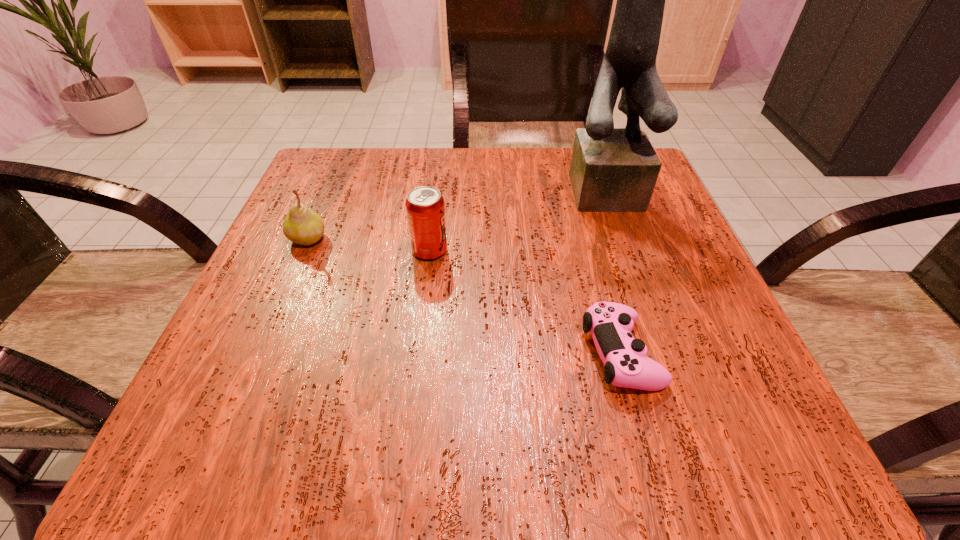
Locate an element on the screen. This screenshot has width=960, height=540. vacant space at the near right corner of the desktop is located at coordinates (764, 404).

The width and height of the screenshot is (960, 540). Find the location of `vacant area between the farthest object and the shortest object`. vacant area between the farthest object and the shortest object is located at coordinates (617, 269).

This screenshot has width=960, height=540. I want to click on free space between the third object from right to left and the shortest object, so click(525, 302).

At what (x,y) coordinates should I click in order to perform the action: click on vacant point located between the nearest object and the third object from right to left. Please return your answer as a coordinate pair (x, y). Looking at the image, I should click on (525, 302).

You are a GUI agent. You are given a task and a screenshot of the screen. Output one action in this format:
    pyautogui.click(x=<x>, y=<y>)
    Task: Click on the unoccupied area between the soda can and the leftmost object
    This screenshot has width=960, height=540.
    Given the screenshot: What is the action you would take?
    pyautogui.click(x=369, y=245)

Locate an element on the screen. This screenshot has height=540, width=960. vacant point located between the sculpture and the leftmost object is located at coordinates (461, 212).

Find the location of a particular element. The height and width of the screenshot is (540, 960). vacant region between the farthest object and the second object from left to right is located at coordinates (521, 218).

Image resolution: width=960 pixels, height=540 pixels. I want to click on empty space between the pear and the sculpture, so click(461, 212).

This screenshot has height=540, width=960. Identify the location of free space between the leftmost object and the control. (465, 296).

Image resolution: width=960 pixels, height=540 pixels. Find the location of `free space between the pear and the sculpture`. free space between the pear and the sculpture is located at coordinates (461, 212).